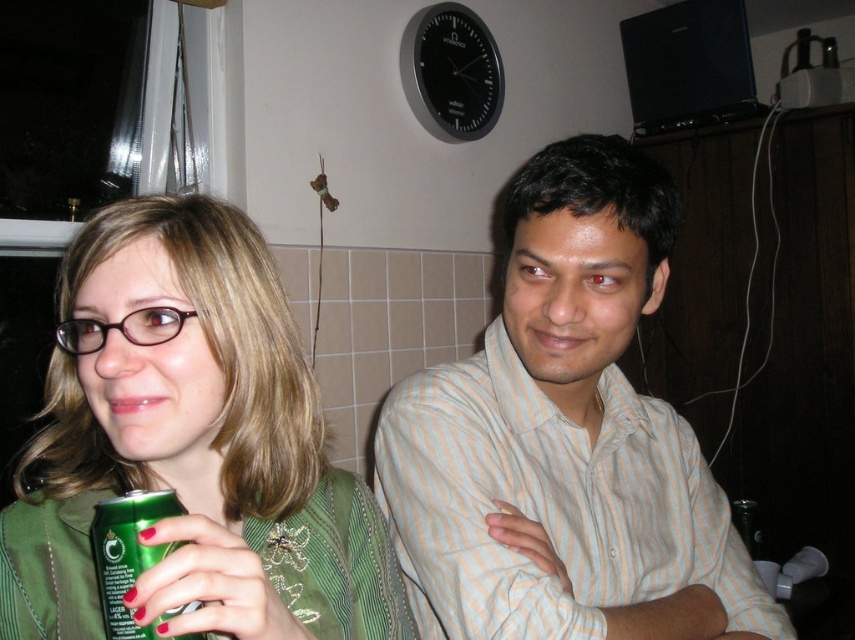
You are standing in the room where the two people are sitting. You want to find the light beige striped shirt at center. Where should you look?

You should look at point (x=565, y=436) to find the light beige striped shirt at center.

Looking at this image, you are planning to place a 15 cm long decorative ribbon between the green matte can at left and the green metallic can at lower left. Will the ribbon fit between them without overlapping either can?

The distance between the green matte can at left and the green metallic can at lower left is 13.89 centimeters. Since the ribbon is 15 cm long, it is longer than the space available, so the ribbon will overlap both cans.

You are organizing a charity event and need to decide which item to place on a small donation box. The light beige striped shirt at center and the green matte can at left are both candidates. Which item would fit better on the small donation box based on their sizes?

The green matte can at left would fit better on the small donation box since it is smaller in size compared to the light beige striped shirt at center.